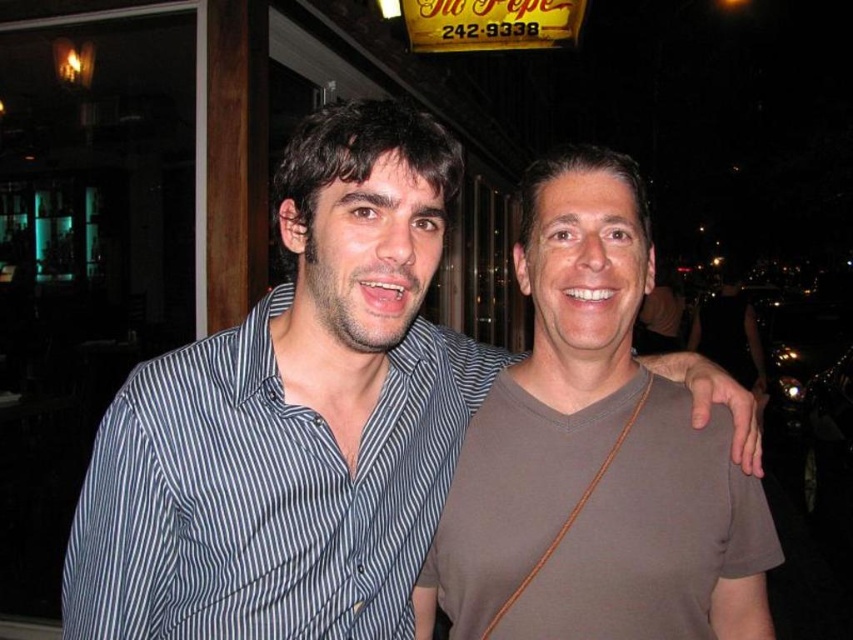
Question: Is striped cotton shirt at center thinner than brown matte shirt at center?

Choices:
 (A) yes
 (B) no

Answer: (B)

Question: Is striped cotton shirt at center positioned before brown matte shirt at center?

Choices:
 (A) yes
 (B) no

Answer: (A)

Question: Which of the following is the closest to the observer?

Choices:
 (A) (595, 416)
 (B) (74, 600)

Answer: (B)

Question: Which point is closer to the camera?

Choices:
 (A) (444, 436)
 (B) (453, 518)

Answer: (B)

Question: Observing the image, what is the correct spatial positioning of striped cotton shirt at center in reference to brown matte shirt at center?

Choices:
 (A) below
 (B) above

Answer: (B)